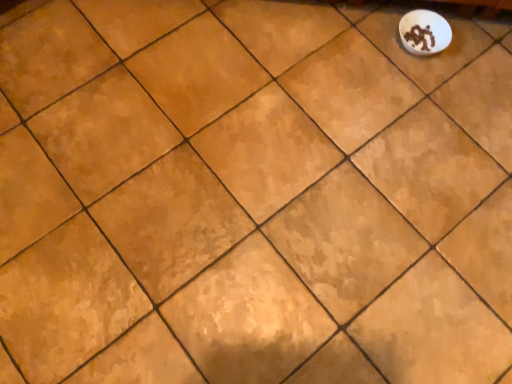
Image resolution: width=512 pixels, height=384 pixels. In order to click on free space to the right of white glossy bowl at upper right in this screenshot , I will do `click(476, 53)`.